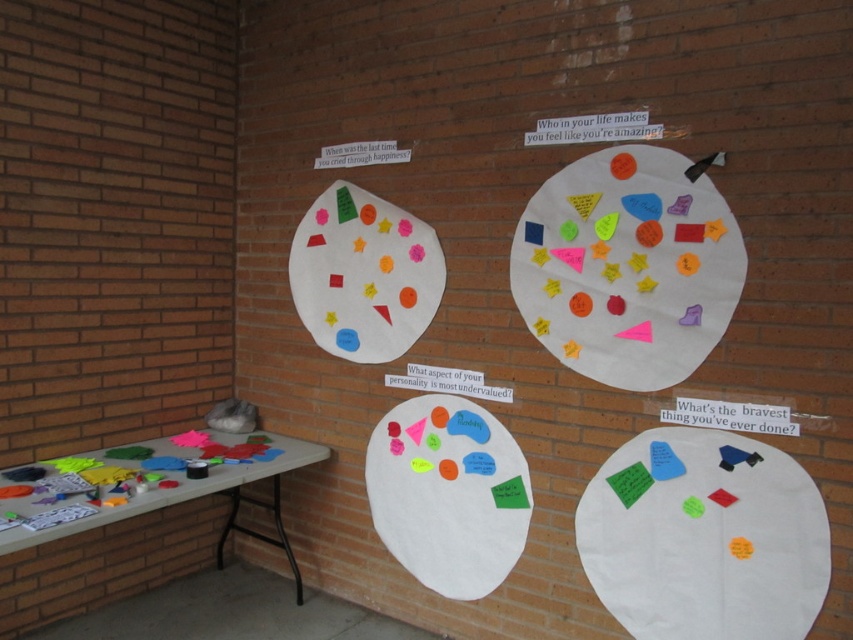
Question: Does white matte paper plate at lower right appear on the left side of white matte paper plate at center?

Choices:
 (A) no
 (B) yes

Answer: (A)

Question: Does white matte paper plate at lower right have a greater width compared to white matte paper plate at center?

Choices:
 (A) no
 (B) yes

Answer: (B)

Question: Estimate the real-world distances between objects in this image. Which object is farther from the matte felt shapes at center?

Choices:
 (A) multicolored felt shapes at center
 (B) white matte paper plate at lower right
 (C) white matte paper plate at center

Answer: (B)

Question: Based on their relative distances, which object is farther from the white matte paper plate at lower right?

Choices:
 (A) smooth gray table at lower left
 (B) matte felt shapes at center
 (C) white matte paper plate at center

Answer: (A)

Question: Does multicolored felt shapes at center appear on the right side of smooth gray table at lower left?

Choices:
 (A) yes
 (B) no

Answer: (A)

Question: Which point is farther to the camera?

Choices:
 (A) (9, 600)
 (B) (376, 524)
 (C) (552, 224)

Answer: (B)